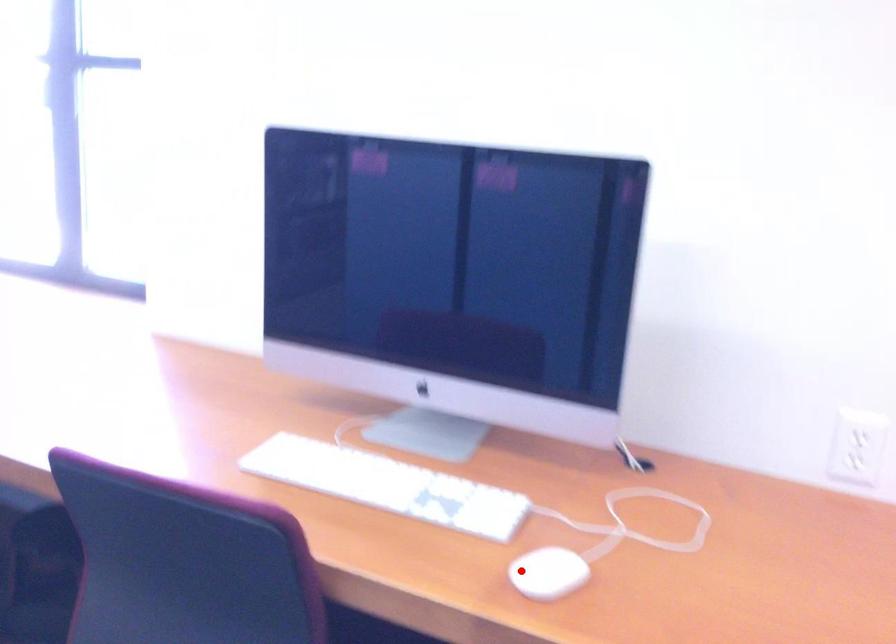
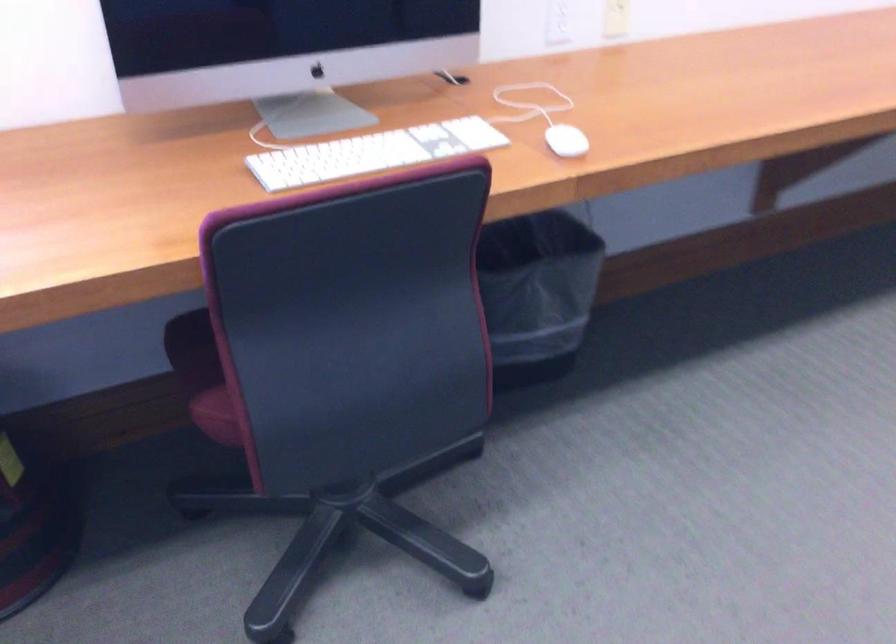
Find the pixel in the second image that matches the highlighted location in the first image.

(565, 140)